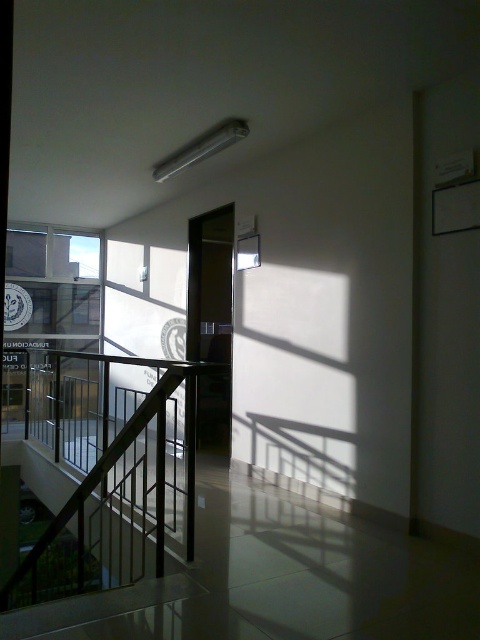
You are a delivery person carrying a large package and need to navigate through the black metal railing at center and the transparent glass window at upper left. Based on their positions, which object is closer to you as you face the scene?

The black metal railing at center is closer to you because it is in front of the transparent glass window at upper left.

You are a painter who needs to hang a 1.5 meter wide canvas. You see the black metal railing at center and the transparent glass window at upper left. Which object has enough space to accommodate the canvas without overlapping any other objects?

The black metal railing at center might be wider than transparent glass window at upper left, so it could potentially provide sufficient space for the 1.5 meter wide canvas. However, since the exact width isn not specified, it is recommended to measure the railing first before deciding.

You are a delivery person carrying a large package that requires a clear path to the door located near the transparent glass window at upper left. The black metal railing at center is in your way. Can you navigate around it without hitting the railing? Please explain your reasoning based on the distance provided.

The black metal railing at center is 2.05 meters away from the transparent glass window at upper left. Since the railing is positioned between you and the window, you need to move around it. Assuming the package is standard in size, the 2.05 meters distance should provide enough space to maneuver around the railing safely without collision. However, you must ensure that your path does not encroach into other potential obstacles not mentioned.